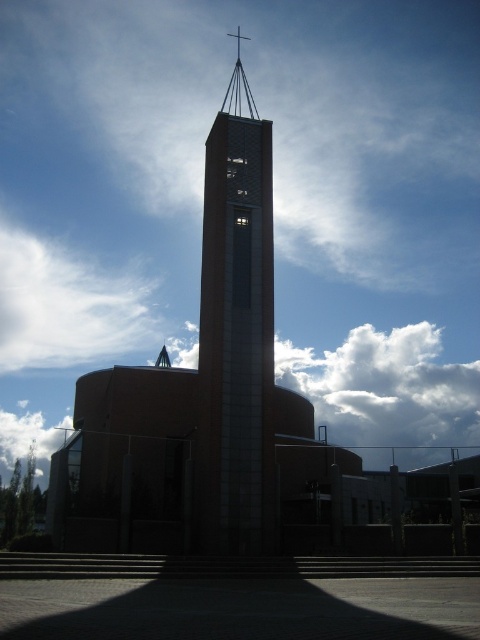
Which is in front, point (264, 340) or point (38, 449)?

Point (264, 340) is more forward.

What do you see at coordinates (237, 330) in the screenshot?
I see `smooth concrete bell tower at center` at bounding box center [237, 330].

Between point (235, 99) and point (44, 428), which one is positioned behind?

Point (44, 428)

Identify the location of smooth concrete bell tower at center. (237, 330).